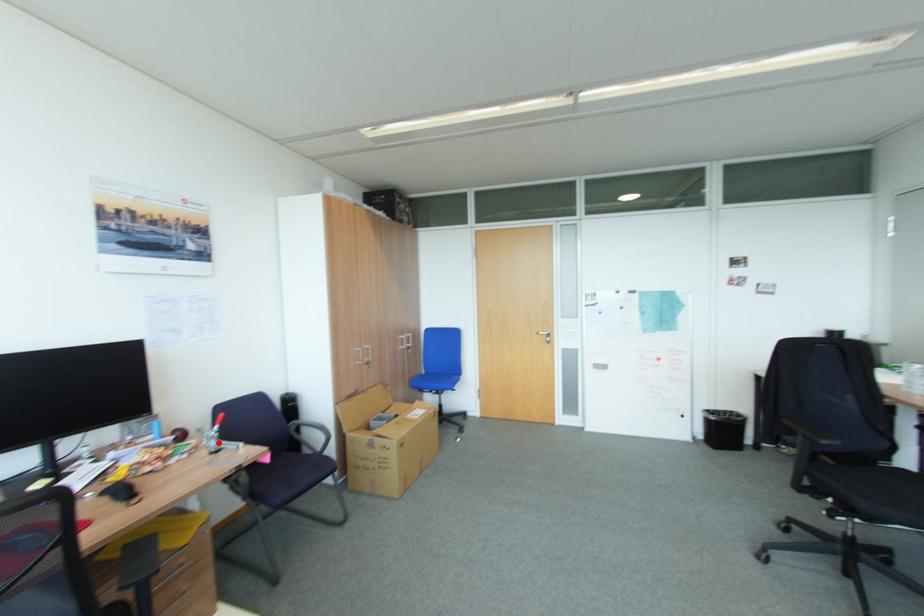
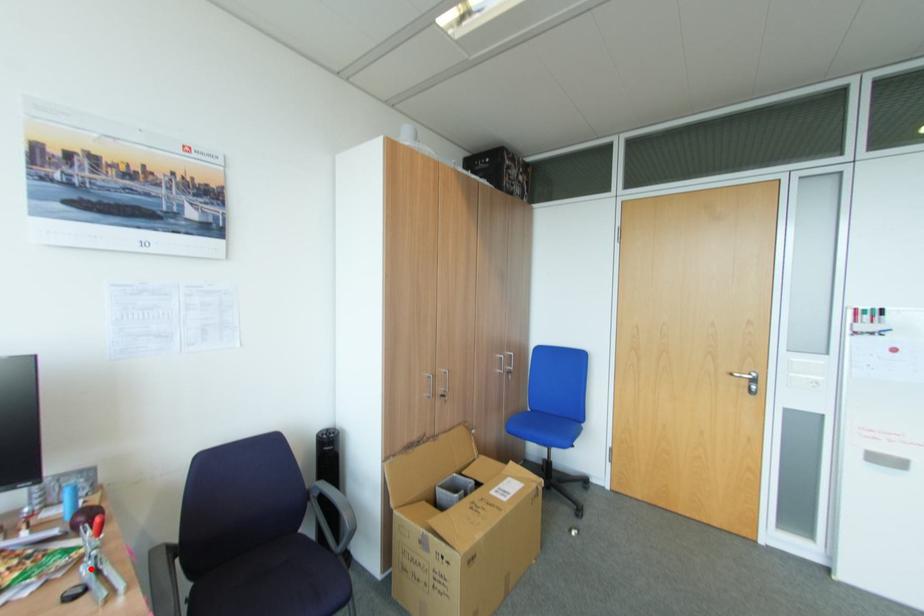
I am providing you with two images of the same scene from different viewpoints. A red point is marked on the first image and another point is marked on the second image. Does the point marked in image1 correspond to the same location as the one in image2?

Yes